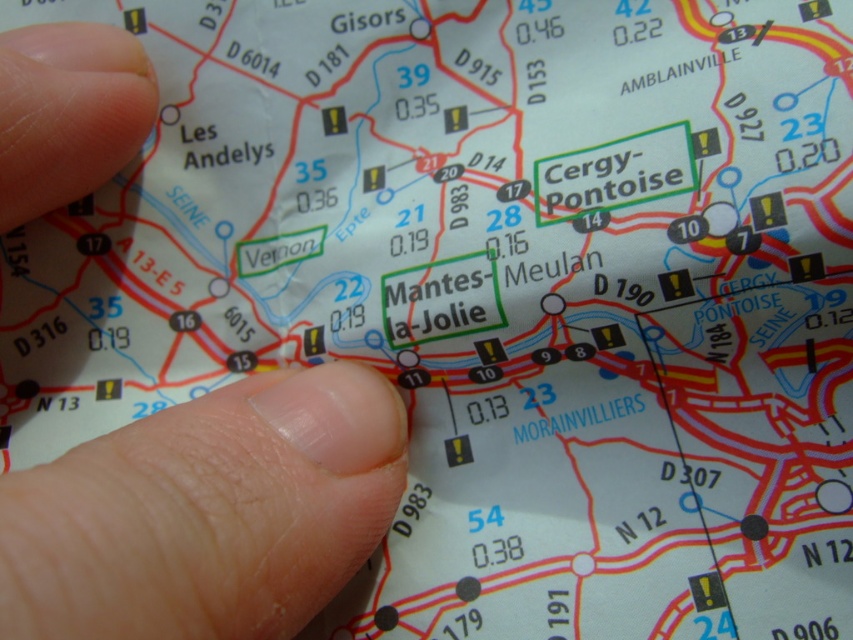
You are looking at a road map and want to determine the exact location of your finger at left. Based on the map details provided, can you identify which town or city your finger is pointing to?

The finger at left is located at point (207, 513) on the map, but without specific town coordinates or scale, it is impossible to determine the exact town or city it points to.

You are examining a road map and notice two points labeled as point [183,604] and point [71,52]. Which of these points appears closer to you on the map?

Point [183,604] is closer to the camera than point [71,52], so it appears closer on the map.